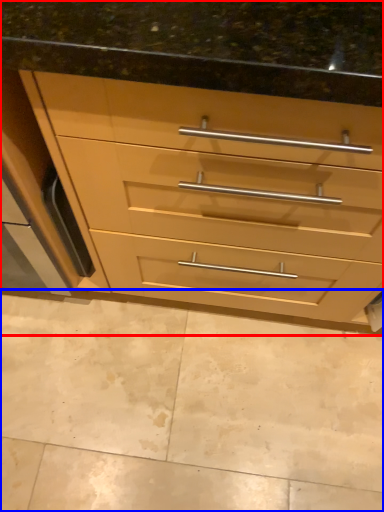
Question: Among these objects, which one is farthest to the camera, chest of drawers (highlighted by a red box) or granite (highlighted by a blue box)?

Choices:
 (A) chest of drawers
 (B) granite

Answer: (B)